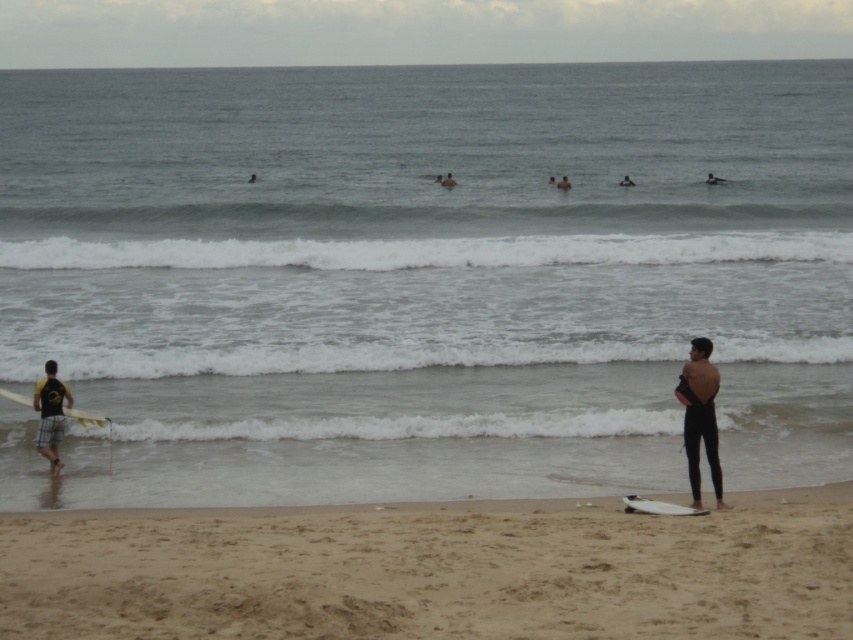
Question: Which object appears farthest from the camera in this image?

Choices:
 (A) white matte surfboard at left
 (B) smooth black wetsuit at center

Answer: (B)

Question: Which point is closer to the camera?

Choices:
 (A) (100, 426)
 (B) (444, 556)
 (C) (625, 179)
 (D) (38, 433)

Answer: (B)

Question: Which point appears farthest from the camera in this image?

Choices:
 (A) (683, 422)
 (B) (701, 628)

Answer: (A)

Question: Is yellow plaid shorts at left positioned at the back of white matte surfboard at left?

Choices:
 (A) yes
 (B) no

Answer: (B)

Question: Does fine-grained sand at lower center appear over smooth black wetsuit at center?

Choices:
 (A) no
 (B) yes

Answer: (A)

Question: Is black matte wetsuit at right further to the viewer compared to white matte surfboard at lower right?

Choices:
 (A) no
 (B) yes

Answer: (B)